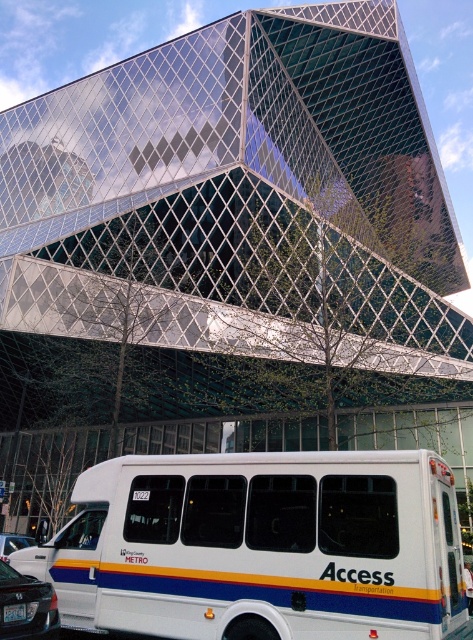
Question: Which point is closer to the camera?

Choices:
 (A) metallic silver car at lower left
 (B) metallic silver sedan at lower left
 (C) white metallic van at center

Answer: (C)

Question: Where is metallic silver sedan at lower left located in relation to metallic silver car at lower left in the image?

Choices:
 (A) below
 (B) above

Answer: (B)

Question: Which object is the closest to the white metallic van at center?

Choices:
 (A) metallic silver car at lower left
 (B) metallic silver sedan at lower left

Answer: (B)

Question: Observing the image, what is the correct spatial positioning of white metallic van at center in reference to metallic silver sedan at lower left?

Choices:
 (A) right
 (B) left

Answer: (A)

Question: Based on their relative distances, which object is nearer to the metallic silver sedan at lower left?

Choices:
 (A) metallic silver car at lower left
 (B) white metallic van at center

Answer: (B)

Question: In this image, where is white metallic van at center located relative to metallic silver sedan at lower left?

Choices:
 (A) above
 (B) below

Answer: (A)